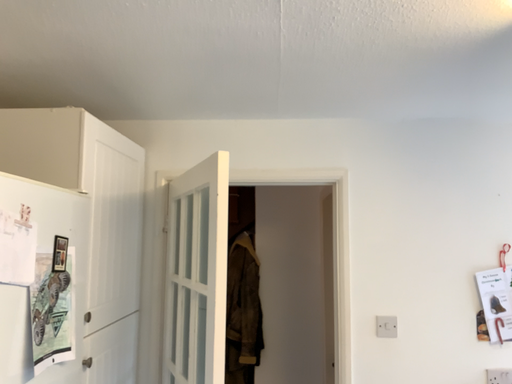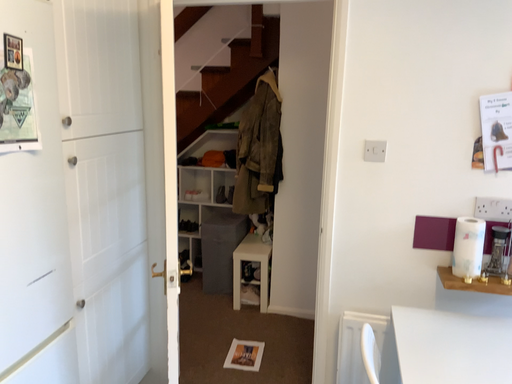
Question: How did the camera likely rotate when shooting the video?

Choices:
 (A) rotated right
 (B) rotated left

Answer: (B)